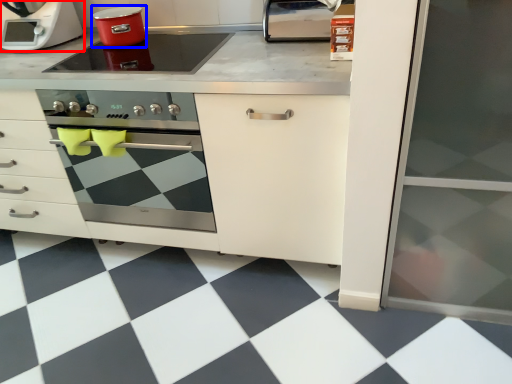
Question: Among these objects, which one is farthest to the camera, home appliance (highlighted by a red box) or kitchen appliance (highlighted by a blue box)?

Choices:
 (A) home appliance
 (B) kitchen appliance

Answer: (A)